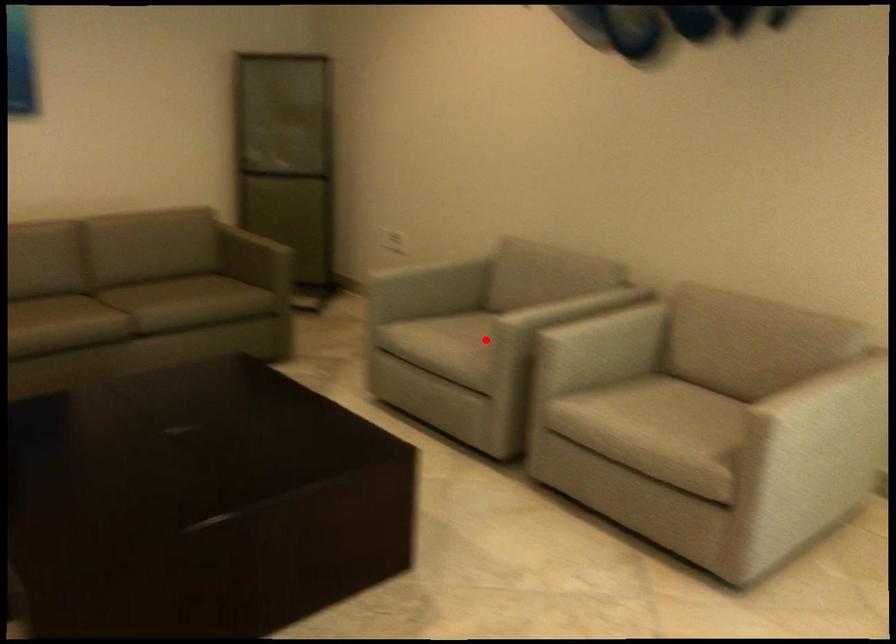
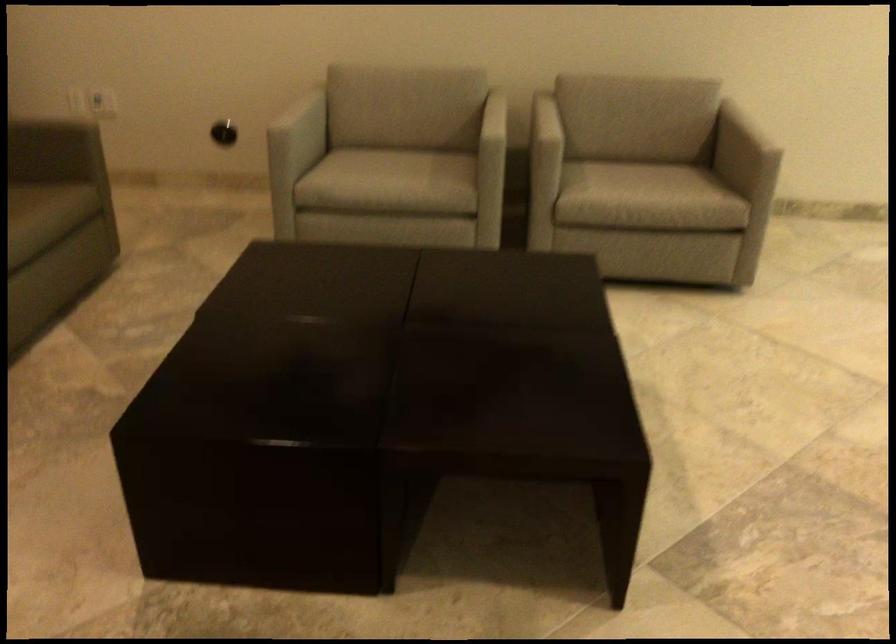
In the second image, find the point that corresponds to the highlighted location in the first image.

(492, 151)